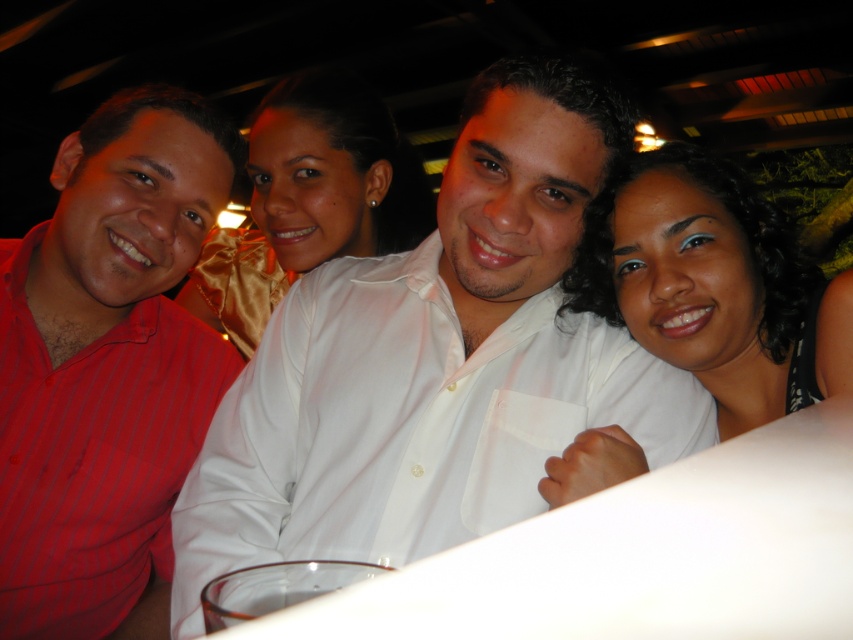
Question: Which point is closer to the camera?

Choices:
 (A) white satin blouse at center
 (B) white satin shirt at center

Answer: (B)

Question: Among these points, which one is farthest from the camera?

Choices:
 (A) (236, 243)
 (B) (96, 452)

Answer: (A)

Question: Does white satin shirt at center lie in front of red striped shirt at left?

Choices:
 (A) no
 (B) yes

Answer: (B)

Question: From the image, what is the correct spatial relationship of white satin shirt at center in relation to white satin blouse at center?

Choices:
 (A) right
 (B) left

Answer: (A)

Question: Can you confirm if red striped shirt at left is thinner than white satin blouse at center?

Choices:
 (A) yes
 (B) no

Answer: (A)

Question: Among these points, which one is nearest to the camera?

Choices:
 (A) (28, 376)
 (B) (326, 204)
 (C) (616, 410)
 (D) (630, 461)

Answer: (D)